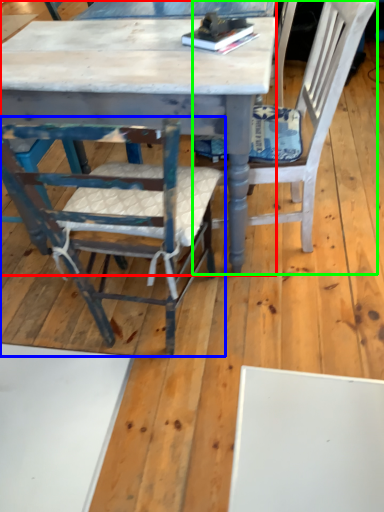
Question: Based on their relative distances, which object is farther from table (highlighted by a red box)? Choose from chair (highlighted by a blue box) and chair (highlighted by a green box).

Choices:
 (A) chair
 (B) chair

Answer: (B)